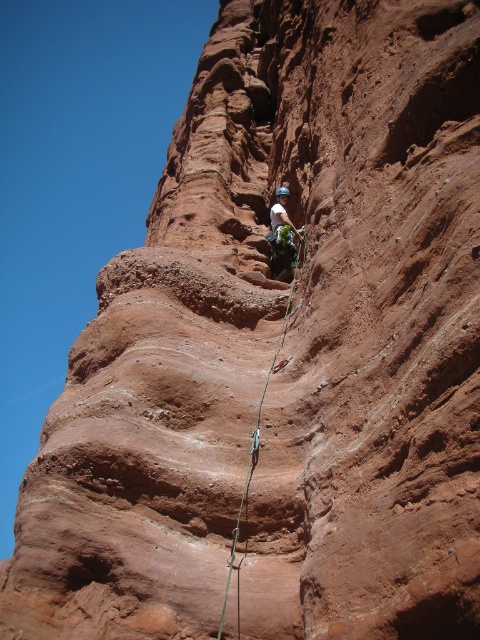
A rock climber is ascending a steep rock face. You are standing at point [274,353] and want to reach the climber. The distance between you and the climber is 73.28 meters. If your maximum safe climbing distance is 60 meters, should you attempt to reach the climber?

The distance between you and the climber is 73.28 meters, which exceeds your maximum safe climbing distance of 60 meters. Therefore, you should not attempt to reach the climber.

You are a rock climber trying to locate your green nylon rope at center. According to the coordinates provided, where would you look relative to the climber?

The green nylon rope at center is located at coordinates point (261,406), which is to the right and slightly below the climber.

You are a safety inspector assessing the rock climber in the image. You notice the green nylon rope at center and the matte blue helmet at center. Which object is positioned in front of the other from your viewpoint?

The green nylon rope at center is closer to the viewer than the matte blue helmet at center, so the green nylon rope at center is positioned in front of the matte blue helmet at center.